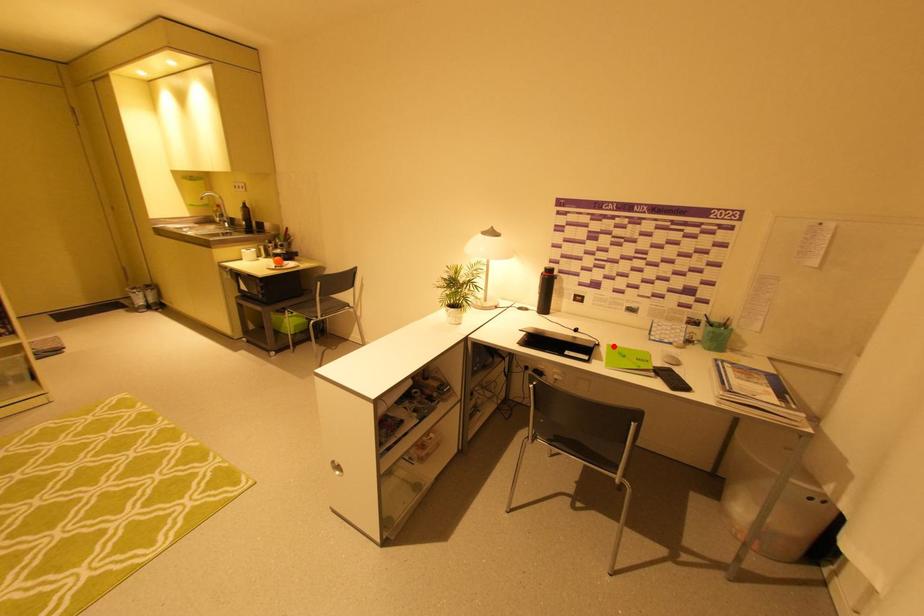
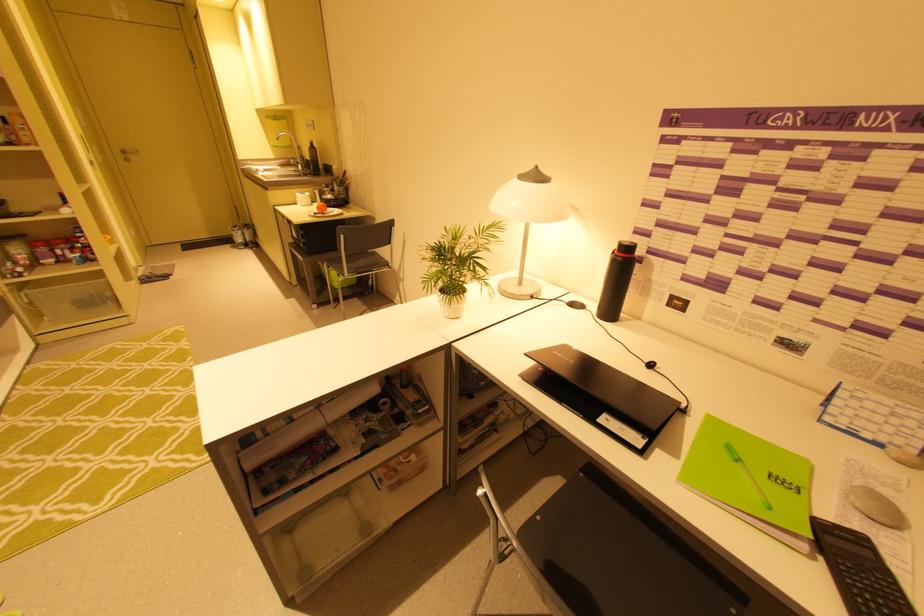
The point at the highlighted location is marked in the first image. Where is the corresponding point in the second image?

(714, 419)